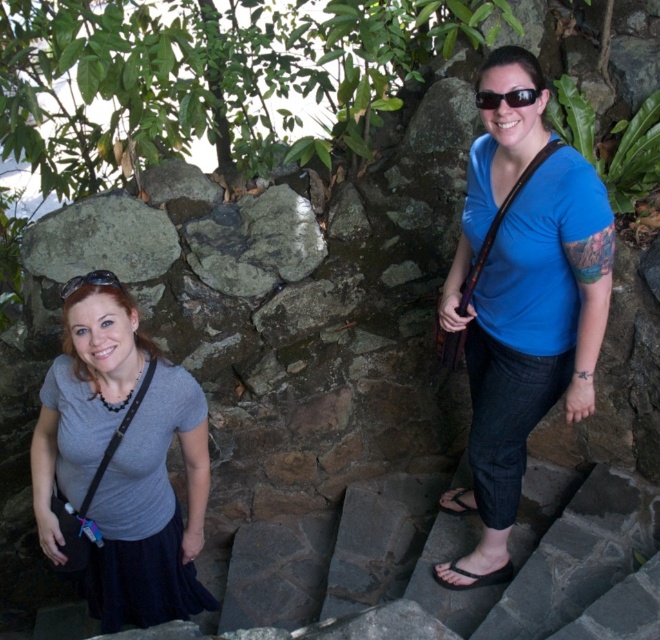
Question: Where is gray matte shirt at center located in relation to black rubber sandal at lower right in the image?

Choices:
 (A) above
 (B) below

Answer: (A)

Question: Which point is farther from the camera taking this photo?

Choices:
 (A) (482, 577)
 (B) (114, 296)
 (C) (550, 284)
 (D) (490, 108)

Answer: (A)

Question: Estimate the real-world distances between objects in this image. Which object is farther from the black flip-flop at lower center?

Choices:
 (A) black rubber sandal at lower right
 (B) blue matte shirt at upper right
 (C) clear plastic goggles at upper left

Answer: (C)

Question: Does sunglasses at upper right have a greater width compared to black flip-flop at lower center?

Choices:
 (A) no
 (B) yes

Answer: (B)

Question: Is sunglasses at upper right in front of clear plastic goggles at upper left?

Choices:
 (A) no
 (B) yes

Answer: (B)

Question: Which object is farther from the camera taking this photo?

Choices:
 (A) blue matte shirt at upper right
 (B) black rubber sandal at lower right

Answer: (B)